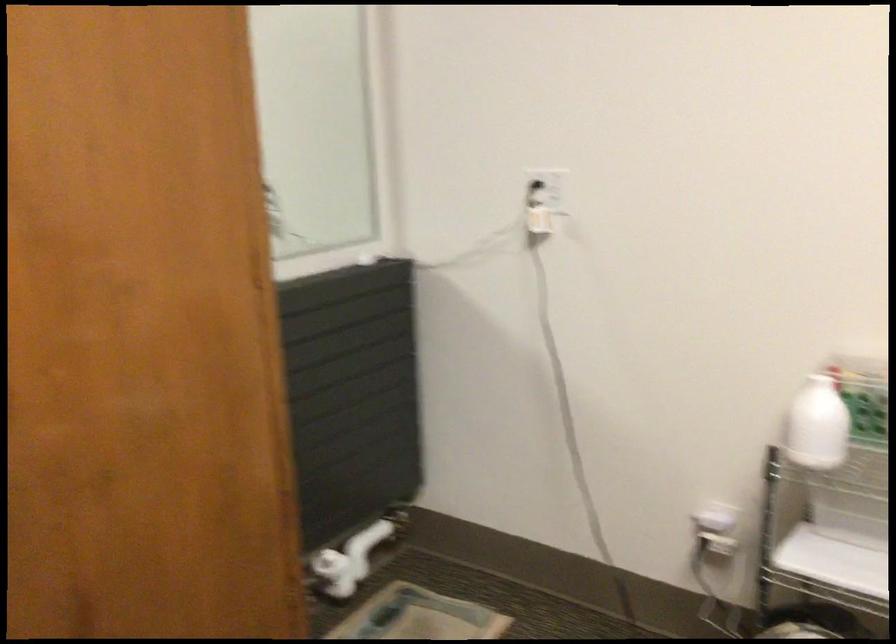
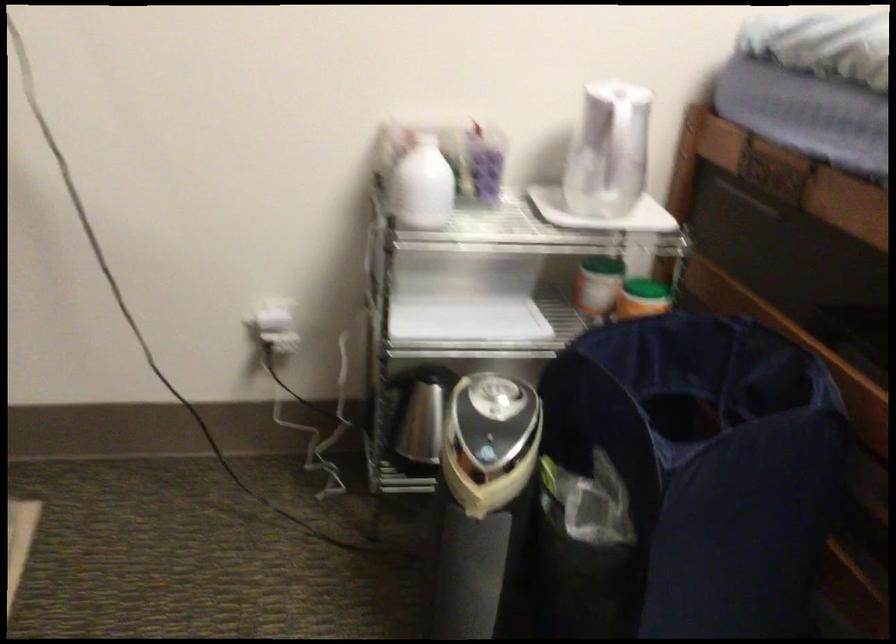
Based on the continuous images, in which direction is the camera rotating?

The camera's rotation is toward right-down.